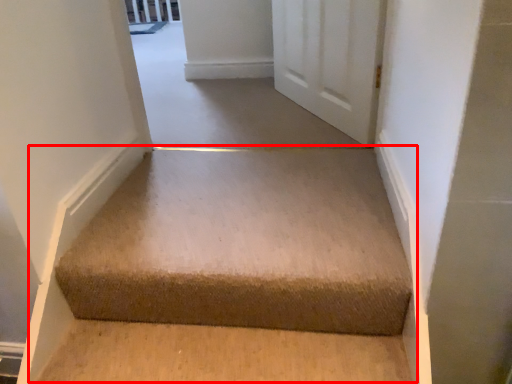
Question: From the image's perspective, where is stairwell (annotated by the red box) located relative to passage?

Choices:
 (A) above
 (B) below

Answer: (B)